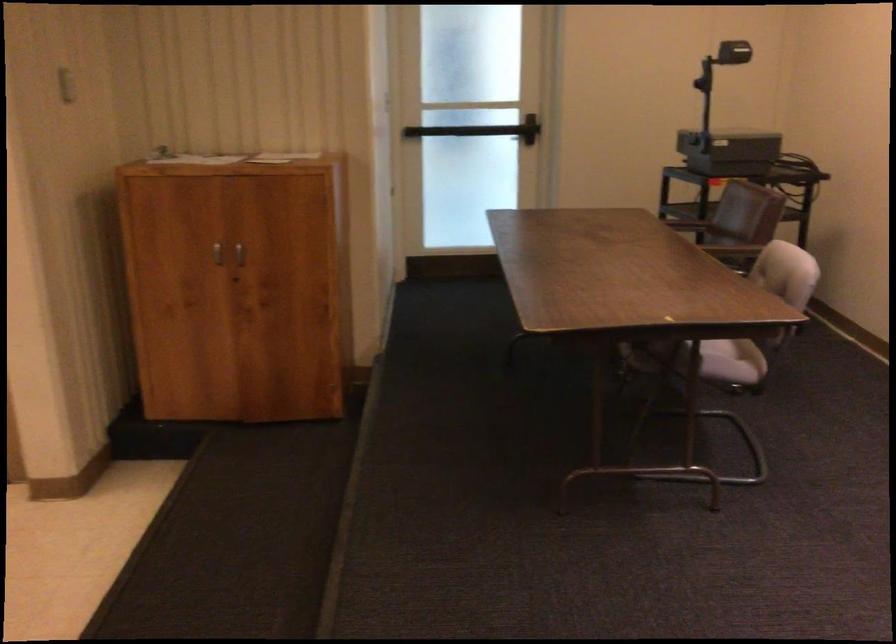
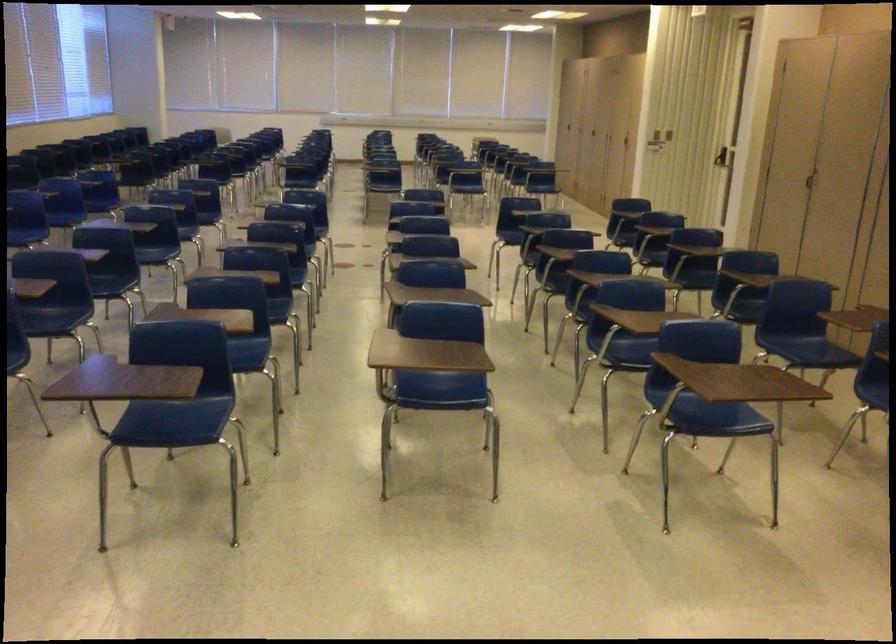
Question: The images are taken continuously from a first-person perspective. In which direction is your viewpoint rotating?

Choices:
 (A) Left
 (B) Right
 (C) Up
 (D) Down

Answer: (A)